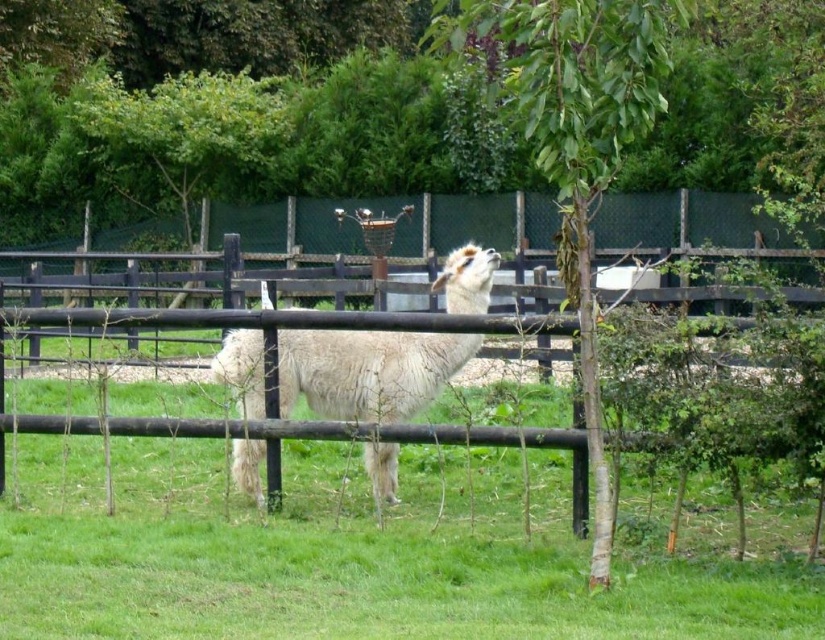
You are a photographer standing at the camera position. You want to take a photo of the green leafy tree at center. The camera has a maximum focus distance of 20 feet. Will the tree be in focus?

The green leafy tree at center is 21.16 feet from the camera, which exceeds the maximum focus distance of 20 feet. Therefore, the tree will not be in focus.

You are standing at the origin point of the coordinate system in the image. The black wood fence at center is located at a specific coordinate. Can you determine its exact coordinates?

The black wood fence at center is located at point (304,260).

You are standing in front of the fenced enclosure with the llama. There are two points marked on the ground near the fence. One is at coordinates point (493, 221) and the other at point (534, 113). Which point is closer to you?

Point (493, 221) is closer to you because it is further to the viewer than point (534, 113).